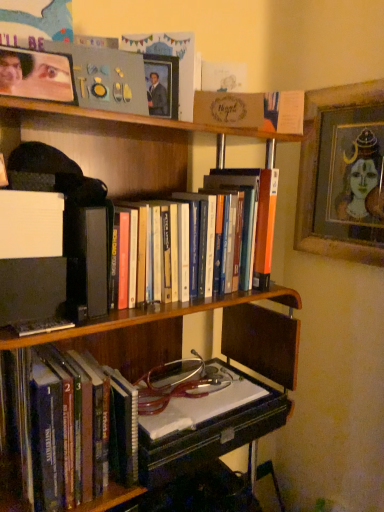
Question: Which direction should I rotate to face wooden picture frame at upper center, acting as the 2th picture frame starting from the front, — up or down?

Choices:
 (A) down
 (B) up

Answer: (B)

Question: Is wooden bookcase at center wider than matte plastic picture frame at upper left, which is counted as the third picture frame, starting from the right?

Choices:
 (A) no
 (B) yes

Answer: (B)

Question: From the image's perspective, is wooden bookcase at center located above matte plastic picture frame at upper left, the 1th picture frame positioned from the front?

Choices:
 (A) yes
 (B) no

Answer: (B)

Question: Is wooden bookcase at center facing towards matte plastic picture frame at upper left, which ranks as the third picture frame in back-to-front order?

Choices:
 (A) no
 (B) yes

Answer: (A)

Question: Can you confirm if wooden bookcase at center is thinner than matte plastic picture frame at upper left, which is counted as the third picture frame, starting from the right?

Choices:
 (A) yes
 (B) no

Answer: (B)

Question: From the image's perspective, is wooden bookcase at center below matte plastic picture frame at upper left, which ranks as the third picture frame in back-to-front order?

Choices:
 (A) no
 (B) yes

Answer: (B)

Question: Is wooden bookcase at center to the left of matte plastic picture frame at upper left, which is counted as the third picture frame, starting from the right, from the viewer's perspective?

Choices:
 (A) yes
 (B) no

Answer: (B)

Question: Is matte plastic picture frame at upper left, which ranks as the third picture frame in back-to-front order, completely or partially outside of wooden bookcase at center?

Choices:
 (A) no
 (B) yes

Answer: (B)

Question: Is matte plastic picture frame at upper left, the 1th picture frame positioned from the front, oriented away from wooden bookcase at center?

Choices:
 (A) yes
 (B) no

Answer: (B)

Question: Is matte plastic picture frame at upper left, which ranks as the third picture frame in back-to-front order, with wooden bookcase at center?

Choices:
 (A) yes
 (B) no

Answer: (B)

Question: Can you confirm if matte plastic picture frame at upper left, which is counted as the third picture frame, starting from the right, is taller than wooden bookcase at center?

Choices:
 (A) no
 (B) yes

Answer: (A)

Question: From a real-world perspective, is matte plastic picture frame at upper left, which ranks as the third picture frame in back-to-front order, below wooden bookcase at center?

Choices:
 (A) no
 (B) yes

Answer: (A)

Question: From a real-world perspective, is matte plastic picture frame at upper left, the 1th picture frame viewed from the left, physically above wooden bookcase at center?

Choices:
 (A) no
 (B) yes

Answer: (B)

Question: From a real-world perspective, is hardcover books at center, arranged as the second book when ordered from the bottom, on wooden picture frame at upper center, positioned as the 2th picture frame in back-to-front order?

Choices:
 (A) no
 (B) yes

Answer: (A)